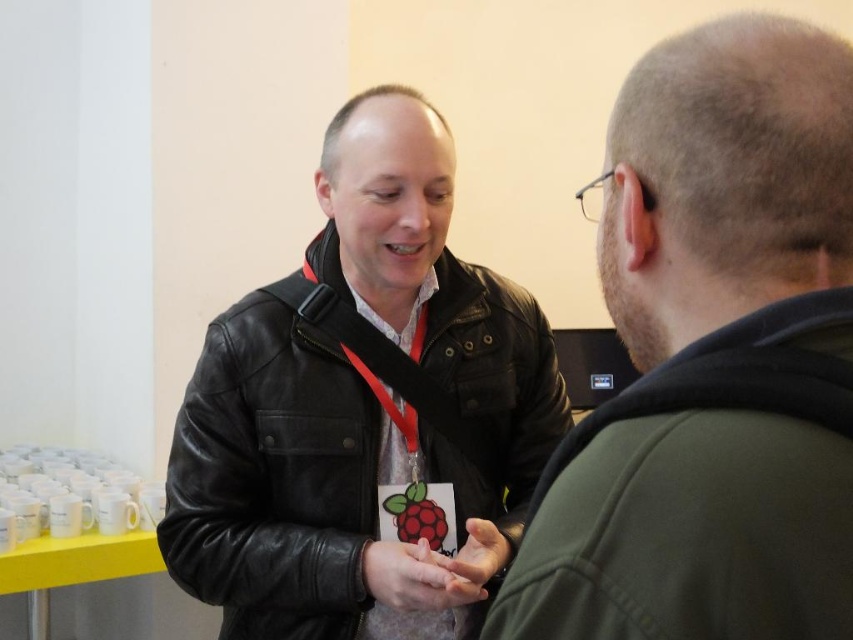
In the scene shown: Can you confirm if black leather jacket at center is positioned below white matte neck at center?

Yes.

Which is in front, point (558, 376) or point (397, 298)?

Point (397, 298) is more forward.

Is point (508, 480) closer to viewer compared to point (376, 244)?

No, it is behind (376, 244).

Identify the location of black leather jacket at center. (273, 477).

Who is more forward, (804, 308) or (437, 442)?

Point (804, 308)

Based on the photo, does matte black leather jacket at center appear under black leather jacket at center?

Actually, matte black leather jacket at center is above black leather jacket at center.

Who is more forward, (744, 19) or (352, 611)?

Positioned in front is point (744, 19).

At what (x,y) coordinates should I click in order to perform the action: click on matte black leather jacket at center. Please return your answer as a coordinate pair (x, y). Looking at the image, I should click on (711, 358).

Is matte black leather jacket at center bigger than white matte neck at center?

Yes.

Is point (817, 177) positioned in front of point (410, 316)?

Yes.

What do you see at coordinates (711, 358) in the screenshot?
I see `matte black leather jacket at center` at bounding box center [711, 358].

Image resolution: width=853 pixels, height=640 pixels. I want to click on matte black leather jacket at center, so click(x=711, y=358).